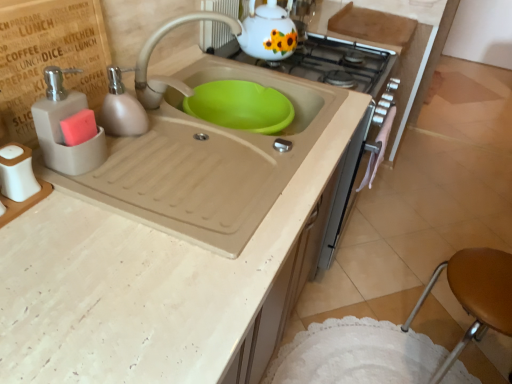
Question: Does matte gray soap dispenser at left appear on the left side of beige matte sink at center?

Choices:
 (A) no
 (B) yes

Answer: (B)

Question: Does matte gray soap dispenser at left lie in front of beige matte sink at center?

Choices:
 (A) yes
 (B) no

Answer: (A)

Question: From the image's perspective, is matte gray soap dispenser at left located above beige matte sink at center?

Choices:
 (A) no
 (B) yes

Answer: (B)

Question: Is the position of matte gray soap dispenser at left more distant than that of beige matte sink at center?

Choices:
 (A) yes
 (B) no

Answer: (B)

Question: From a real-world perspective, does matte gray soap dispenser at left stand above beige matte sink at center?

Choices:
 (A) no
 (B) yes

Answer: (B)

Question: Do you think matte beige soap dispenser at left, the second soap dispenser in the front-to-back sequence, is within brown leather stool at lower right, or outside of it?

Choices:
 (A) outside
 (B) inside

Answer: (A)

Question: In the image, is matte beige soap dispenser at left, the second soap dispenser in the front-to-back sequence, positioned in front of or behind brown leather stool at lower right?

Choices:
 (A) behind
 (B) front

Answer: (B)

Question: Is matte beige soap dispenser at left, the second soap dispenser in the front-to-back sequence, to the left or to the right of brown leather stool at lower right in the image?

Choices:
 (A) left
 (B) right

Answer: (A)

Question: Based on their sizes in the image, would you say matte beige soap dispenser at left, the second soap dispenser in the front-to-back sequence, is bigger or smaller than brown leather stool at lower right?

Choices:
 (A) small
 (B) big

Answer: (A)

Question: From the image's perspective, is beige matte sink at center positioned above or below matte beige soap dispenser at left, the second soap dispenser in the front-to-back sequence?

Choices:
 (A) below
 (B) above

Answer: (A)

Question: In the image, is beige matte sink at center on the left side or the right side of matte beige soap dispenser at left, which is the first soap dispenser in back-to-front order?

Choices:
 (A) right
 (B) left

Answer: (A)

Question: In terms of height, does beige matte sink at center look taller or shorter compared to matte beige soap dispenser at left, the second soap dispenser in the front-to-back sequence?

Choices:
 (A) tall
 (B) short

Answer: (A)

Question: Is beige matte sink at center bigger or smaller than matte beige soap dispenser at left, the second soap dispenser in the front-to-back sequence?

Choices:
 (A) small
 (B) big

Answer: (B)

Question: Is white glossy gas stove at upper center to the left or to the right of matte gray soap dispenser at left, which appears as the 1th soap dispenser when viewed from the front, in the image?

Choices:
 (A) left
 (B) right

Answer: (B)

Question: Is white glossy gas stove at upper center taller or shorter than matte gray soap dispenser at left, the 2th soap dispenser positioned from the back?

Choices:
 (A) tall
 (B) short

Answer: (B)